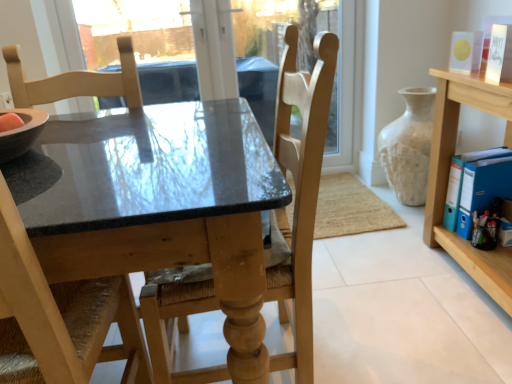
Question: Is white textured vase at right smaller than light wood shelf at right?

Choices:
 (A) no
 (B) yes

Answer: (B)

Question: Considering the relative positions of white textured vase at right and light wood shelf at right in the image provided, is white textured vase at right behind light wood shelf at right?

Choices:
 (A) no
 (B) yes

Answer: (B)

Question: Could you tell me if white textured vase at right is facing light wood shelf at right?

Choices:
 (A) no
 (B) yes

Answer: (A)

Question: From the image's perspective, is white textured vase at right located beneath light wood shelf at right?

Choices:
 (A) yes
 (B) no

Answer: (B)

Question: Is the position of white textured vase at right less distant than that of light wood shelf at right?

Choices:
 (A) yes
 (B) no

Answer: (B)

Question: Is light wood chair at left, which ranks as the first chair in left-to-right order, inside or outside of light wood shelf at right?

Choices:
 (A) inside
 (B) outside

Answer: (B)

Question: From a real-world perspective, is light wood chair at left, which ranks as the first chair in left-to-right order, positioned above or below light wood shelf at right?

Choices:
 (A) above
 (B) below

Answer: (A)

Question: In terms of width, does light wood chair at left, which ranks as the first chair in left-to-right order, look wider or thinner when compared to light wood shelf at right?

Choices:
 (A) thin
 (B) wide

Answer: (A)

Question: Is point (19, 326) positioned closer to the camera than point (445, 175)?

Choices:
 (A) farther
 (B) closer

Answer: (B)

Question: From a real-world perspective, is white textured vase at right physically located above or below wooden chair at center, the 1th chair when ordered from right to left?

Choices:
 (A) below
 (B) above

Answer: (A)

Question: Is white textured vase at right in front of or behind wooden chair at center, the 1th chair when ordered from right to left, in the image?

Choices:
 (A) behind
 (B) front

Answer: (A)

Question: From the image's perspective, relative to wooden chair at center, the 1th chair when ordered from right to left, is white textured vase at right above or below?

Choices:
 (A) above
 (B) below

Answer: (A)

Question: Would you say white textured vase at right is to the left or to the right of wooden chair at center, placed as the 2th chair when sorted from left to right, in the picture?

Choices:
 (A) left
 (B) right

Answer: (B)

Question: Choose the correct answer: Is light wood shelf at right inside matte black table at center or outside it?

Choices:
 (A) outside
 (B) inside

Answer: (A)

Question: Is light wood shelf at right bigger or smaller than matte black table at center?

Choices:
 (A) big
 (B) small

Answer: (B)